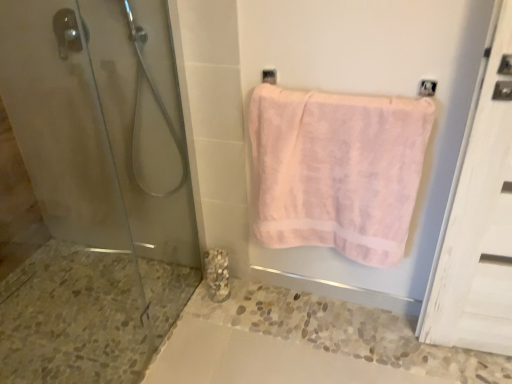
Describe the element at coordinates (337, 170) in the screenshot. The image size is (512, 384). I see `pink fluffy towel at upper right` at that location.

Describe the element at coordinates (95, 193) in the screenshot. I see `transparent glass shower door at left` at that location.

At what (x,y) coordinates should I click in order to perform the action: click on clear glass shower at left. Please return your answer as a coordinate pair (x, y). Image resolution: width=512 pixels, height=384 pixels. Looking at the image, I should click on (156, 103).

Looking at this image, is transparent glass shower door at left facing towards clear glass shower at left?

No, transparent glass shower door at left is not aimed at clear glass shower at left.

Identify the location of shower behind the transparent glass shower door at left. (156, 103).

From a real-world perspective, between transparent glass shower door at left and clear glass shower at left, who is vertically higher?

From a 3D spatial view, clear glass shower at left is above.

Who is smaller, transparent glass shower door at left or clear glass shower at left?

clear glass shower at left is smaller.

Which is more distant, (76, 344) or (62, 29)?

The point (76, 344) is more distant.

Which of these two, transparent glass shower door at left or matte silver towel bar at upper center, is thinner?

With smaller width is matte silver towel bar at upper center.

You are a GUI agent. You are given a task and a screenshot of the screen. Output one action in this format:
    pyautogui.click(x=<x>, y=<y>)
    Task: Click on the towel bar located on the left of transparent glass shower door at left
    This screenshot has height=384, width=512.
    Given the screenshot: What is the action you would take?
    pyautogui.click(x=67, y=32)

Would you say pink fluffy towel at upper right is part of marble textured at lower left's contents?

Actually, pink fluffy towel at upper right is outside marble textured at lower left.

Image resolution: width=512 pixels, height=384 pixels. I want to click on towel that appears in front of the marble textured at lower left, so click(337, 170).

Is marble textured at lower left bigger than pink fluffy towel at upper right?

No, marble textured at lower left is not bigger than pink fluffy towel at upper right.

Looking at this image, considering the positions of objects marble textured at lower left and pink fluffy towel at upper right in the image provided, who is more to the left, marble textured at lower left or pink fluffy towel at upper right?

marble textured at lower left is more to the left.

Based on their positions, is clear glass shower at left located to the left or right of pink fluffy towel at upper right?

Clearly, clear glass shower at left is on the left of pink fluffy towel at upper right in the image.

At what (x,y) coordinates should I click in order to perform the action: click on shower located on the left of pink fluffy towel at upper right. Please return your answer as a coordinate pair (x, y). The width and height of the screenshot is (512, 384). Looking at the image, I should click on (156, 103).

Does clear glass shower at left turn towards pink fluffy towel at upper right?

No, clear glass shower at left is not oriented towards pink fluffy towel at upper right.

Which point is more distant from viewer, (140, 40) or (425, 115)?

The point (140, 40) is farther from the camera.

Considering the relative positions of matte silver towel bar at upper center and clear glass shower at left in the image provided, is matte silver towel bar at upper center to the left or to the right of clear glass shower at left?

Clearly, matte silver towel bar at upper center is on the left of clear glass shower at left in the image.

From a real-world perspective, which object rests below the other?

clear glass shower at left, from a real-world perspective.

From the image's perspective, which is above, matte silver towel bar at upper center or clear glass shower at left?

matte silver towel bar at upper center, from the image's perspective.

Between pink fluffy towel at upper right and matte silver towel bar at upper center, which one appears on the left side from the viewer's perspective?

matte silver towel bar at upper center is more to the left.

From a real-world perspective, is pink fluffy towel at upper right located beneath matte silver towel bar at upper center?

Indeed, from a real-world perspective, pink fluffy towel at upper right is positioned beneath matte silver towel bar at upper center.

Considering the sizes of pink fluffy towel at upper right and matte silver towel bar at upper center in the image, is pink fluffy towel at upper right bigger or smaller than matte silver towel bar at upper center?

Clearly, pink fluffy towel at upper right is larger in size than matte silver towel bar at upper center.

From the image's perspective, is pink fluffy towel at upper right located above or below matte silver towel bar at upper center?

pink fluffy towel at upper right is below matte silver towel bar at upper center.

Is clear glass shower at left completely or partially outside of matte silver towel bar at upper center?

Yes, clear glass shower at left is not within matte silver towel bar at upper center.

Is clear glass shower at left turned away from matte silver towel bar at upper center?

That's not correct — clear glass shower at left is not looking away from matte silver towel bar at upper center.

Is clear glass shower at left positioned far away from matte silver towel bar at upper center?

No.

In the scene shown: Considering the sizes of objects clear glass shower at left and matte silver towel bar at upper center in the image provided, who is bigger, clear glass shower at left or matte silver towel bar at upper center?

clear glass shower at left.

Where is `shower that is above the transparent glass shower door at left (from a real-world perspective)`? shower that is above the transparent glass shower door at left (from a real-world perspective) is located at coordinates (156, 103).

Where is `towel bar behind the transparent glass shower door at left`? towel bar behind the transparent glass shower door at left is located at coordinates (67, 32).

Looking at the image, which one is located closer to pink fluffy towel at upper right, marble textured at lower left or clear glass shower at left?

clear glass shower at left lies closer to pink fluffy towel at upper right than the other object.

Looking at the image, which one is located further to transparent glass shower door at left, pink fluffy towel at upper right or matte silver towel bar at upper center?

pink fluffy towel at upper right is positioned further to the anchor transparent glass shower door at left.

Considering their positions, is matte silver towel bar at upper center positioned further to marble textured at lower left than pink fluffy towel at upper right?

matte silver towel bar at upper center is positioned further to the anchor marble textured at lower left.

When comparing their distances from clear glass shower at left, does marble textured at lower left or pink fluffy towel at upper right seem further?

pink fluffy towel at upper right is further to clear glass shower at left.

When comparing their distances from pink fluffy towel at upper right, does marble textured at lower left or transparent glass shower door at left seem further?

transparent glass shower door at left is further to pink fluffy towel at upper right.

Estimate the real-world distances between objects in this image. Which object is closer to pink fluffy towel at upper right, transparent glass shower door at left or marble textured at lower left?

Based on the image, marble textured at lower left appears to be nearer to pink fluffy towel at upper right.

Estimate the real-world distances between objects in this image. Which object is further from transparent glass shower door at left, pink fluffy towel at upper right or clear glass shower at left?

pink fluffy towel at upper right.

Estimate the real-world distances between objects in this image. Which object is further from pink fluffy towel at upper right, marble textured at lower left or matte silver towel bar at upper center?

Based on the image, matte silver towel bar at upper center appears to be further to pink fluffy towel at upper right.

Where is `towel bar between transparent glass shower door at left and marble textured at lower left in the front-back direction`? towel bar between transparent glass shower door at left and marble textured at lower left in the front-back direction is located at coordinates (67, 32).

This screenshot has height=384, width=512. In order to click on shower between matte silver towel bar at upper center and marble textured at lower left in the up-down direction in this screenshot , I will do `click(156, 103)`.

This screenshot has height=384, width=512. Identify the location of towel located between transparent glass shower door at left and marble textured at lower left in the depth direction. (337, 170).

Identify the location of towel between transparent glass shower door at left and matte silver towel bar at upper center in the front-back direction. Image resolution: width=512 pixels, height=384 pixels. (337, 170).